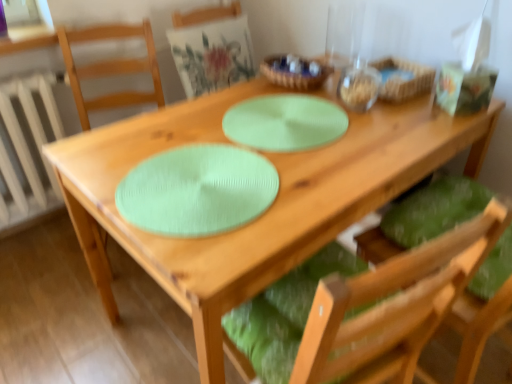
Question: Is white painted metal radiator at left bigger than woven wood basket at upper right?

Choices:
 (A) no
 (B) yes

Answer: (B)

Question: Considering the relative positions of white painted metal radiator at left and woven wood basket at upper right in the image provided, is white painted metal radiator at left behind woven wood basket at upper right?

Choices:
 (A) no
 (B) yes

Answer: (B)

Question: Can you confirm if white painted metal radiator at left is positioned to the right of woven wood basket at upper right?

Choices:
 (A) no
 (B) yes

Answer: (A)

Question: Is white painted metal radiator at left closer to camera compared to woven wood basket at upper right?

Choices:
 (A) no
 (B) yes

Answer: (A)

Question: Is white painted metal radiator at left positioned with its back to woven wood basket at upper right?

Choices:
 (A) no
 (B) yes

Answer: (A)

Question: From the image's perspective, does white painted metal radiator at left appear higher than woven wood basket at upper right?

Choices:
 (A) no
 (B) yes

Answer: (A)

Question: Is woven wood basket at upper right thinner than matte green cushion at upper center, the 1th chair positioned from the left?

Choices:
 (A) no
 (B) yes

Answer: (B)

Question: Does woven wood basket at upper right have a larger size compared to matte green cushion at upper center, the 3th chair from the right?

Choices:
 (A) no
 (B) yes

Answer: (A)

Question: Is woven wood basket at upper right to the left of matte green cushion at upper center, the 3th chair from the right, from the viewer's perspective?

Choices:
 (A) no
 (B) yes

Answer: (A)

Question: Considering the relative positions of woven wood basket at upper right and matte green cushion at upper center, the 3th chair from the right, in the image provided, is woven wood basket at upper right to the right of matte green cushion at upper center, the 3th chair from the right, from the viewer's perspective?

Choices:
 (A) yes
 (B) no

Answer: (A)

Question: From the image's perspective, would you say woven wood basket at upper right is positioned over matte green cushion at upper center, the 3th chair from the right?

Choices:
 (A) no
 (B) yes

Answer: (A)

Question: Can you confirm if woven wood basket at upper right is shorter than matte green cushion at upper center, the 3th chair from the right?

Choices:
 (A) no
 (B) yes

Answer: (B)

Question: Does mint green textured placemat at center lie behind woven wood basket at upper right?

Choices:
 (A) no
 (B) yes

Answer: (A)